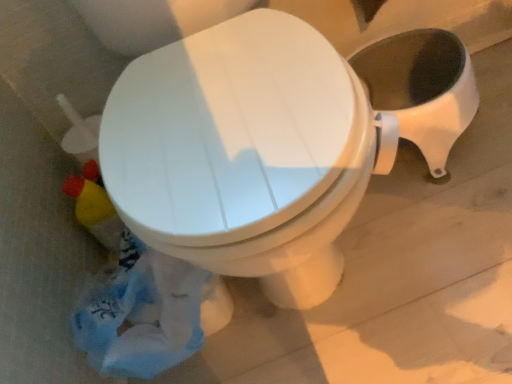
Question: Is blue plastic bag at lower left completely or partially inside white glossy toilet at center?

Choices:
 (A) yes
 (B) no

Answer: (B)

Question: Is white glossy toilet at center shorter than blue plastic bag at lower left?

Choices:
 (A) yes
 (B) no

Answer: (A)

Question: Is white glossy toilet at center positioned with its back to blue plastic bag at lower left?

Choices:
 (A) yes
 (B) no

Answer: (B)

Question: Considering the relative positions of white glossy toilet at center and blue plastic bag at lower left in the image provided, is white glossy toilet at center to the right of blue plastic bag at lower left from the viewer's perspective?

Choices:
 (A) no
 (B) yes

Answer: (B)

Question: Is white glossy toilet at center bigger than blue plastic bag at lower left?

Choices:
 (A) yes
 (B) no

Answer: (A)

Question: From a real-world perspective, is white glossy toilet at center physically above blue plastic bag at lower left?

Choices:
 (A) yes
 (B) no

Answer: (B)

Question: Is white glossy toilet at center located within blue plastic bag at lower left?

Choices:
 (A) no
 (B) yes

Answer: (A)

Question: Considering the relative sizes of blue plastic bag at lower left and white glossy toilet at center in the image provided, is blue plastic bag at lower left wider than white glossy toilet at center?

Choices:
 (A) yes
 (B) no

Answer: (B)

Question: Is blue plastic bag at lower left shorter than white glossy toilet at center?

Choices:
 (A) yes
 (B) no

Answer: (B)

Question: From a real-world perspective, is blue plastic bag at lower left below white glossy toilet at center?

Choices:
 (A) yes
 (B) no

Answer: (B)

Question: Is blue plastic bag at lower left behind white glossy toilet at center?

Choices:
 (A) yes
 (B) no

Answer: (B)

Question: From a real-world perspective, does blue plastic bag at lower left stand above white glossy toilet at center?

Choices:
 (A) yes
 (B) no

Answer: (A)

Question: Considering their positions, is blue plastic bag at lower left located in front of or behind white glossy toilet at center?

Choices:
 (A) front
 (B) behind

Answer: (A)